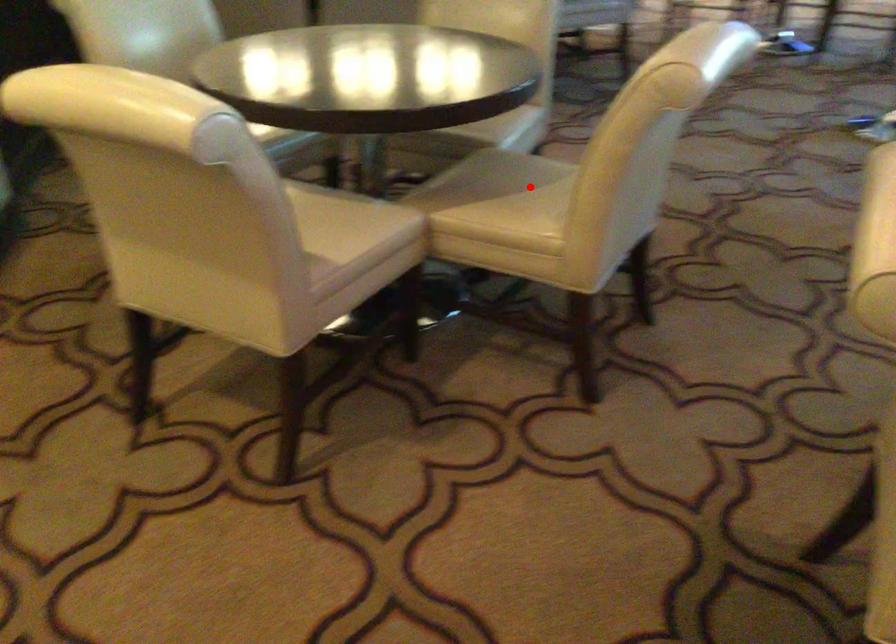
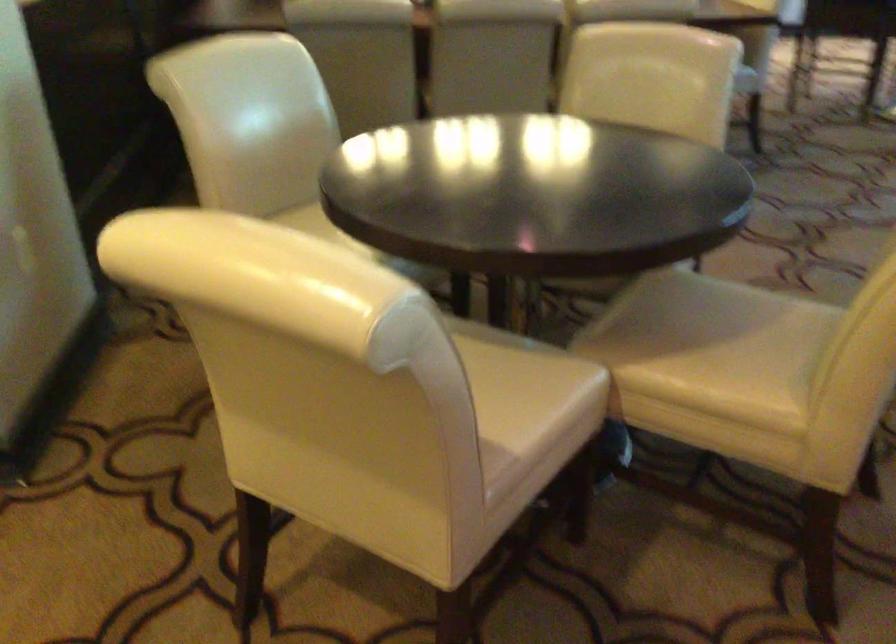
Locate, in the second image, the point that corresponds to the highlighted location in the first image.

(743, 330)